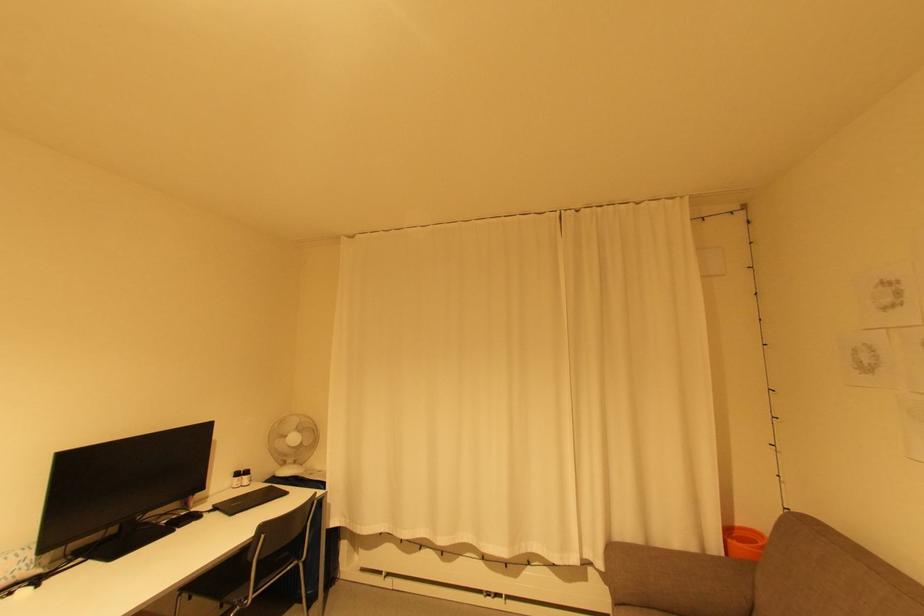
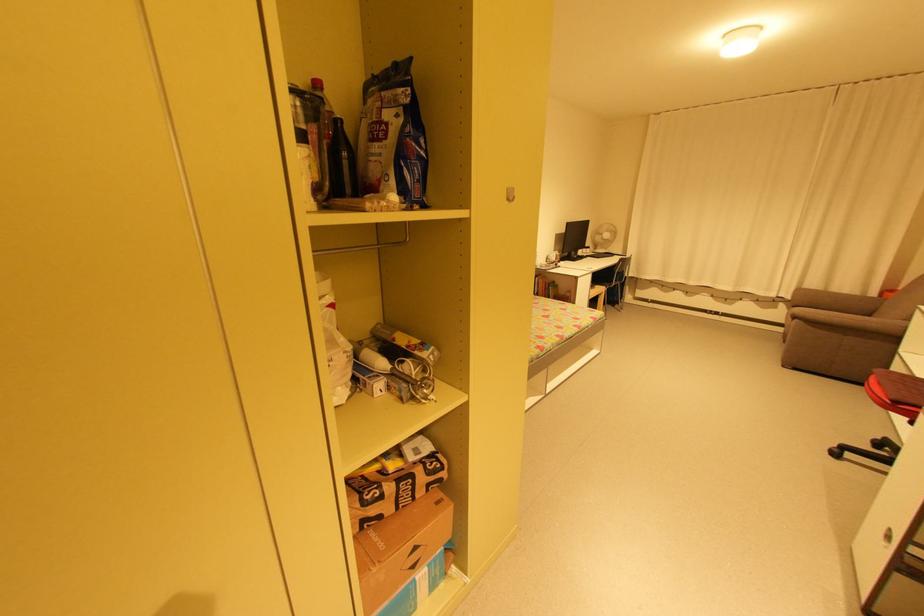
The point at (250, 477) is marked in the first image. Where is the corresponding point in the second image?

(592, 249)